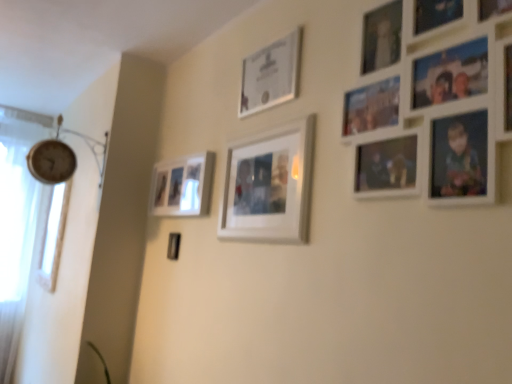
Question: From the image's perspective, relative to clear glass window at left, is matte silver frame at upper center, placed as the 3th picture frame when sorted from left to right, above or below?

Choices:
 (A) below
 (B) above

Answer: (B)

Question: In the image, is matte silver frame at upper center, placed as the 2th picture frame when sorted from back to front, on the left side or the right side of clear glass window at left?

Choices:
 (A) left
 (B) right

Answer: (B)

Question: Considering the real-world distances, which object is closest to the matte silver frame at upper center, which ranks as the second picture frame in right-to-left order?

Choices:
 (A) white matte picture frame at upper right, the 4th picture frame when ordered from back to front
 (B) white matte picture frame at center, the 3th picture frame when ordered from back to front
 (C) clear glass window at left
 (D) matte white picture frame at center left, the first picture frame in the left-to-right sequence

Answer: (B)

Question: Considering the real-world distances, which object is farthest from the matte silver frame at upper center, marked as the third picture frame in a front-to-back arrangement?

Choices:
 (A) white matte picture frame at center, arranged as the 2th picture frame when viewed from the left
 (B) white matte picture frame at upper right, which is counted as the 1th picture frame, starting from the right
 (C) matte white picture frame at center left, the first picture frame in the left-to-right sequence
 (D) clear glass window at left

Answer: (D)